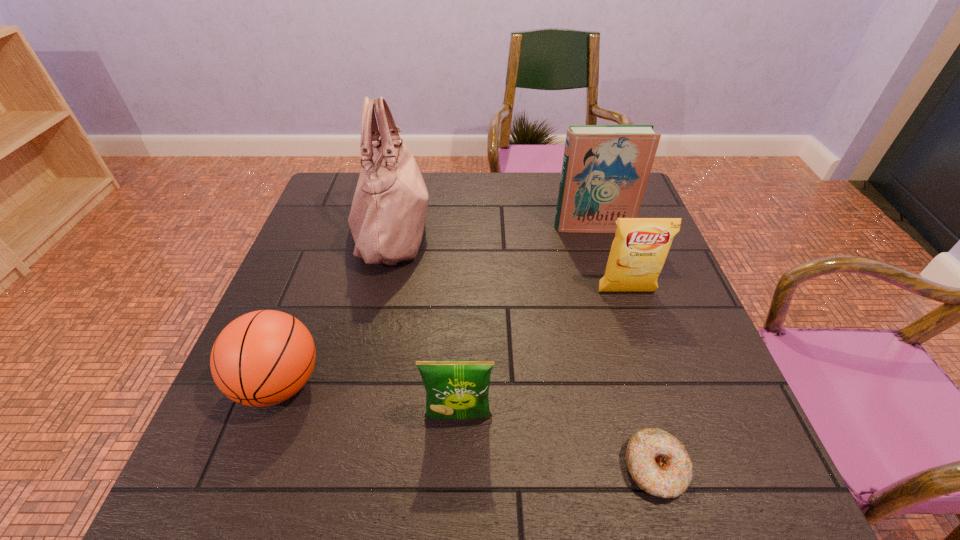
Find the location of a particular element. The width and height of the screenshot is (960, 540). free point that satisfies the following two spatial constraints: 1. on the front-facing side of the third object from left to right; 2. on the left side of the shortest object is located at coordinates (457, 468).

At what (x,y) coordinates should I click in order to perform the action: click on free space that satisfies the following two spatial constraints: 1. on the cover of the fifth shortest object; 2. at the front of the handbag with handles. Please return your answer as a coordinate pair (x, y). The width and height of the screenshot is (960, 540). Looking at the image, I should click on (593, 230).

Find the location of a particular element. The image size is (960, 540). free spot that satisfies the following two spatial constraints: 1. on the front-facing side of the shorter crisp (potato chip); 2. on the right side of the nearest object is located at coordinates (457, 468).